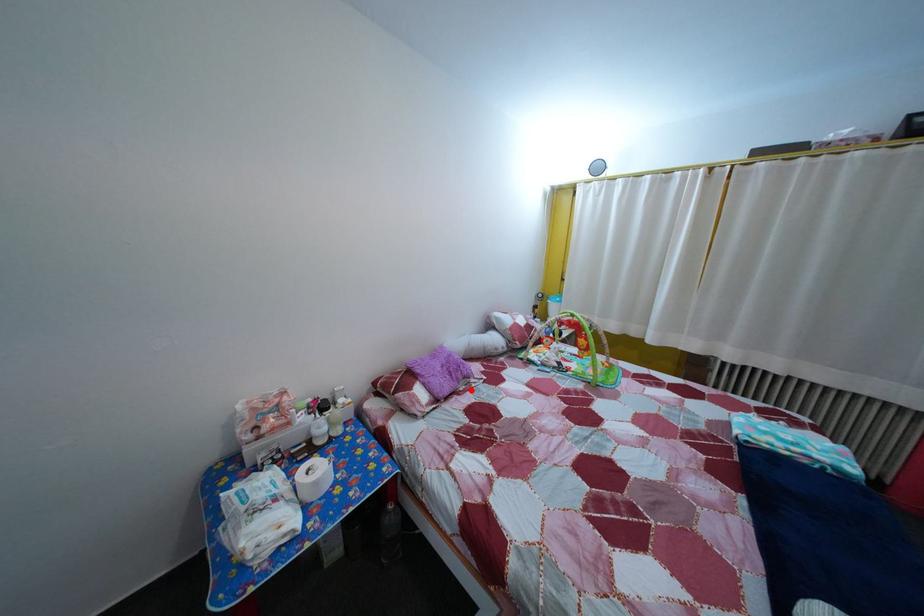
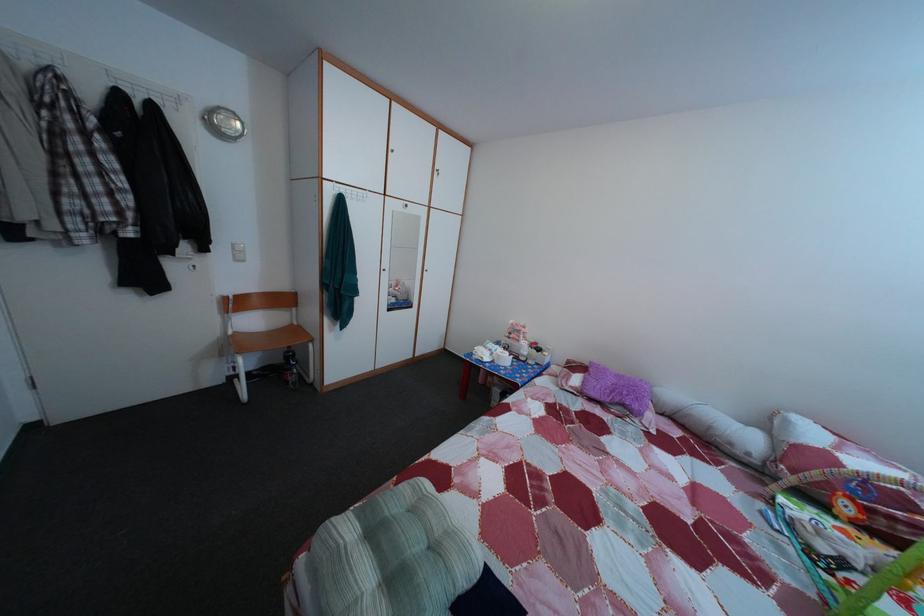
Find the pixel in the second image that matches the highlighted location in the first image.

(628, 416)